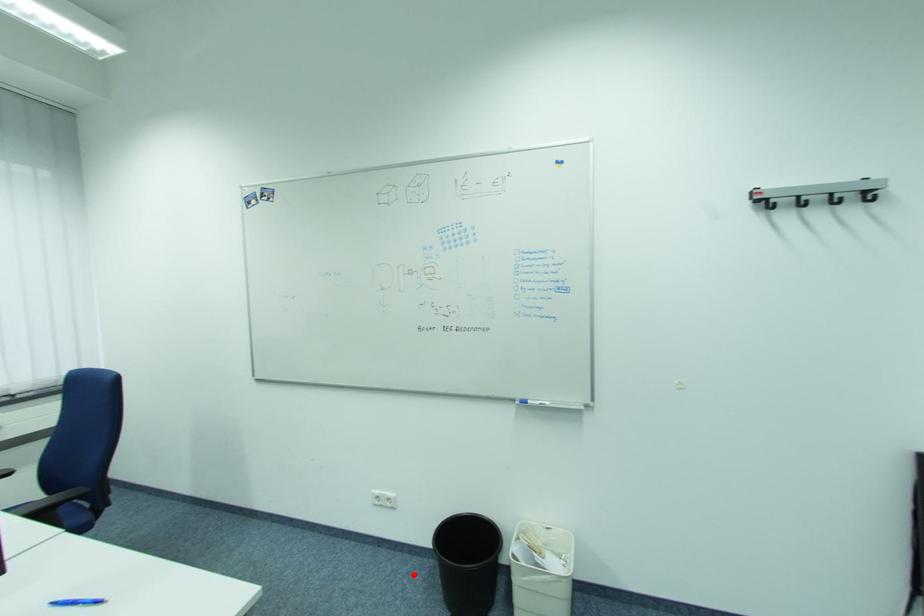
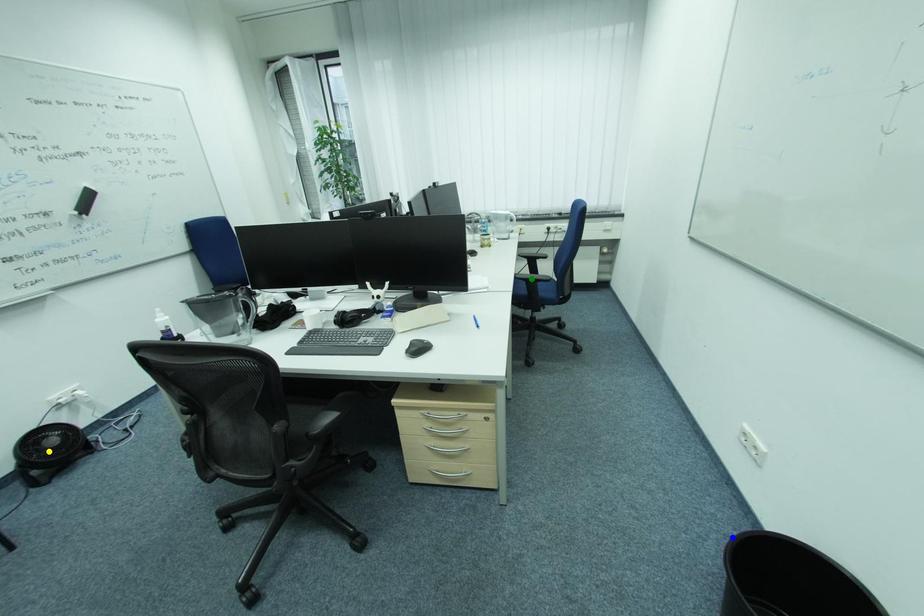
Question: I am providing you with two images of the same scene from different viewpoints. A red point is marked on the first image. You are given multiple points on the second image. Which point in image 2 is actually the same real-world point as the red point in image 1?

Choices:
 (A) blue point
 (B) green point
 (C) yellow point

Answer: (A)